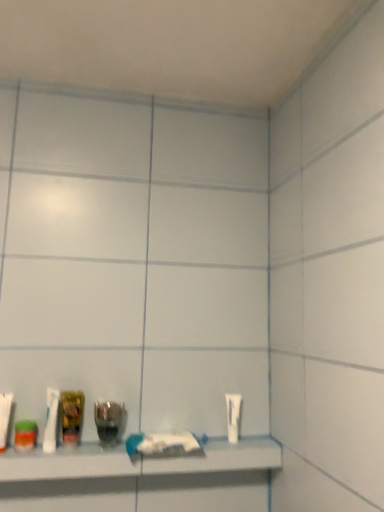
Describe the element at coordinates (25, 435) in the screenshot. I see `translucent plastic mouthwash at lower left, placed as the first mouthwash when sorted from left to right` at that location.

What is the approximate width of translucent plastic mouthwash at lower left, marked as the third mouthwash in a right-to-left arrangement?

It is 3.02 inches.

This screenshot has width=384, height=512. Describe the element at coordinates (108, 420) in the screenshot. I see `clear plastic bottle at lower center, the third mouthwash when ordered from left to right` at that location.

I want to click on translucent plastic mouthwash at lower left, which appears as the 2th mouthwash when viewed from the right, so pos(72,415).

The image size is (384, 512). I want to click on translucent plastic mouthwash at lower left, marked as the third mouthwash in a right-to-left arrangement, so click(25, 435).

Is clear plastic bottle at lower center, which is the 1th mouthwash in right-to-left order, next to white plastic toothbrush at lower left, which is the 1th toiletry from front to back?

No, clear plastic bottle at lower center, which is the 1th mouthwash in right-to-left order, is not next to white plastic toothbrush at lower left, which is the 1th toiletry from front to back.

From a real-world perspective, which object rests below the other?

In real-world perspective, clear plastic bottle at lower center, the third mouthwash when ordered from left to right, is lower.

Is point (120, 409) farther from camera compared to point (0, 436)?

Yes, point (120, 409) is farther from viewer.

Is the position of clear plastic bottle at lower center, the third mouthwash when ordered from left to right, less distant than that of translucent plastic mouthwash at lower left, which appears as the 2th mouthwash when viewed from the right?

No.

From a real-world perspective, is clear plastic bottle at lower center, which is the 1th mouthwash in right-to-left order, physically below translucent plastic mouthwash at lower left, which appears as the 2th mouthwash when viewed from the right?

Correct, in the physical world, clear plastic bottle at lower center, which is the 1th mouthwash in right-to-left order, is lower than translucent plastic mouthwash at lower left, which appears as the 2th mouthwash when viewed from the right.

You are a GUI agent. You are given a task and a screenshot of the screen. Output one action in this format:
    pyautogui.click(x=<x>, y=<y>)
    Task: Click on the mouthwash above the clear plastic bottle at lower center, which is the 1th mouthwash in right-to-left order (from a real-world perspective)
    The width and height of the screenshot is (384, 512).
    Given the screenshot: What is the action you would take?
    pyautogui.click(x=72, y=415)

Is white plastic toothbrush at lower left, which is the 1th toiletry from front to back, positioned beyond the bounds of white matte tube at right, the second toiletry in the left-to-right sequence?

Yes, white plastic toothbrush at lower left, which is the 1th toiletry from front to back, is not within white matte tube at right, the second toiletry in the left-to-right sequence.

Looking at this image, from a real-world perspective, between white plastic toothbrush at lower left, which is the 1th toiletry from front to back, and white matte tube at right, the second toiletry in the left-to-right sequence, who is vertically lower?

In real-world perspective, white plastic toothbrush at lower left, which is the 1th toiletry from front to back, is lower.

Which is farther, (12,401) or (237,426)?

Positioned behind is point (237,426).

Is white plastic toothbrush at lower left, which appears as the first toiletry when viewed from the left, oriented towards white matte tube at right, marked as the 1th toiletry in a right-to-left arrangement?

No, white plastic toothbrush at lower left, which appears as the first toiletry when viewed from the left, is not turned towards white matte tube at right, marked as the 1th toiletry in a right-to-left arrangement.

How different are the orientations of clear plastic bottle at lower center, the third mouthwash when ordered from left to right, and translucent plastic mouthwash at lower left, marked as the third mouthwash in a right-to-left arrangement, in degrees?

0.00207 degrees separate the facing orientations of clear plastic bottle at lower center, the third mouthwash when ordered from left to right, and translucent plastic mouthwash at lower left, marked as the third mouthwash in a right-to-left arrangement.

Between clear plastic bottle at lower center, the third mouthwash when ordered from left to right, and translucent plastic mouthwash at lower left, marked as the third mouthwash in a right-to-left arrangement, which one has smaller width?

Thinner between the two is translucent plastic mouthwash at lower left, marked as the third mouthwash in a right-to-left arrangement.

Is clear plastic bottle at lower center, which is the 1th mouthwash in right-to-left order, in contact with translucent plastic mouthwash at lower left, marked as the third mouthwash in a right-to-left arrangement?

There is a gap between clear plastic bottle at lower center, which is the 1th mouthwash in right-to-left order, and translucent plastic mouthwash at lower left, marked as the third mouthwash in a right-to-left arrangement.

Is clear plastic bottle at lower center, the third mouthwash when ordered from left to right, not inside translucent plastic mouthwash at lower left, marked as the third mouthwash in a right-to-left arrangement?

Indeed, clear plastic bottle at lower center, the third mouthwash when ordered from left to right, is completely outside translucent plastic mouthwash at lower left, marked as the third mouthwash in a right-to-left arrangement.

Based on the photo, does white plastic toothbrush at lower left, acting as the second toiletry starting from the right, have a greater width compared to translucent plastic mouthwash at lower left, marked as the third mouthwash in a right-to-left arrangement?

No.

Is translucent plastic mouthwash at lower left, placed as the first mouthwash when sorted from left to right, at the back of white plastic toothbrush at lower left, which is the second toiletry in back-to-front order?

No.

From the image's perspective, is white plastic toothbrush at lower left, which is the 1th toiletry from front to back, below translucent plastic mouthwash at lower left, placed as the first mouthwash when sorted from left to right?

No.

Who is taller, white matte tube at right, marked as the 1th toiletry in a right-to-left arrangement, or white plastic toothbrush at lower left, acting as the second toiletry starting from the right?

With more height is white matte tube at right, marked as the 1th toiletry in a right-to-left arrangement.

Can you confirm if white matte tube at right, which ranks as the 1th toiletry in back-to-front order, is thinner than white plastic toothbrush at lower left, which appears as the first toiletry when viewed from the left?

Correct, the width of white matte tube at right, which ranks as the 1th toiletry in back-to-front order, is less than that of white plastic toothbrush at lower left, which appears as the first toiletry when viewed from the left.

Is white matte tube at right, the second toiletry in the front-to-back sequence, situated inside white plastic toothbrush at lower left, which is the second toiletry in back-to-front order, or outside?

white matte tube at right, the second toiletry in the front-to-back sequence, is located beyond the bounds of white plastic toothbrush at lower left, which is the second toiletry in back-to-front order.

Can you confirm if white matte tube at right, which ranks as the 1th toiletry in back-to-front order, is bigger than white plastic toothbrush at lower left, which is the second toiletry in back-to-front order?

Yes.

You are a GUI agent. You are given a task and a screenshot of the screen. Output one action in this format:
    pyautogui.click(x=<x>, y=<y>)
    Task: Click on the shelf on the left of white matte tube at right, marked as the 1th toiletry in a right-to-left arrangement
    
    Given the screenshot: What is the action you would take?
    pyautogui.click(x=139, y=461)

In terms of size, does white matte tube at right, which ranks as the 1th toiletry in back-to-front order, appear bigger or smaller than white glossy shelf at lower center?

Clearly, white matte tube at right, which ranks as the 1th toiletry in back-to-front order, is smaller in size than white glossy shelf at lower center.

From a real-world perspective, is white matte tube at right, marked as the 1th toiletry in a right-to-left arrangement, under white glossy shelf at lower center?

No, from a real-world perspective, white matte tube at right, marked as the 1th toiletry in a right-to-left arrangement, is not beneath white glossy shelf at lower center.

From the picture: Is white matte tube at right, the second toiletry in the front-to-back sequence, positioned in front of white glossy shelf at lower center?

No, the depth of white matte tube at right, the second toiletry in the front-to-back sequence, is greater than that of white glossy shelf at lower center.

In order to click on toiletry in front of the clear plastic bottle at lower center, the third mouthwash when ordered from left to right in this screenshot , I will do `click(5, 418)`.

The height and width of the screenshot is (512, 384). I want to click on the 1st mouthwash counting from the left side of the clear plastic bottle at lower center, which is the 1th mouthwash in right-to-left order, so click(72, 415).

Looking at the image, which one is located further to translucent plastic mouthwash at lower left, positioned as the 2th mouthwash in left-to-right order, white matte tube at right, the second toiletry in the left-to-right sequence, or clear plastic bottle at lower center, which is the 1th mouthwash in right-to-left order?

Based on the image, white matte tube at right, the second toiletry in the left-to-right sequence, appears to be further to translucent plastic mouthwash at lower left, positioned as the 2th mouthwash in left-to-right order.

Estimate the real-world distances between objects in this image. Which object is closer to clear plastic bottle at lower center, the third mouthwash when ordered from left to right, white matte tube at right, which ranks as the 1th toiletry in back-to-front order, or white plastic toothbrush at lower left, which is the 1th toiletry from front to back?

white plastic toothbrush at lower left, which is the 1th toiletry from front to back, is positioned closer to the anchor clear plastic bottle at lower center, the third mouthwash when ordered from left to right.

From the image, which object appears to be nearer to white glossy shelf at lower center, clear plastic bottle at lower center, which is the 1th mouthwash in right-to-left order, or white matte tube at right, the second toiletry in the left-to-right sequence?

Based on the image, clear plastic bottle at lower center, which is the 1th mouthwash in right-to-left order, appears to be nearer to white glossy shelf at lower center.

Which object lies further to the anchor point white matte tube at right, the second toiletry in the left-to-right sequence, translucent plastic mouthwash at lower left, marked as the third mouthwash in a right-to-left arrangement, or clear plastic bottle at lower center, which is the 1th mouthwash in right-to-left order?

translucent plastic mouthwash at lower left, marked as the third mouthwash in a right-to-left arrangement.

When comparing their distances from white matte tube at right, marked as the 1th toiletry in a right-to-left arrangement, does translucent plastic mouthwash at lower left, positioned as the 2th mouthwash in left-to-right order, or translucent plastic mouthwash at lower left, marked as the third mouthwash in a right-to-left arrangement, seem further?

Among the two, translucent plastic mouthwash at lower left, marked as the third mouthwash in a right-to-left arrangement, is located further to white matte tube at right, marked as the 1th toiletry in a right-to-left arrangement.

Estimate the real-world distances between objects in this image. Which object is closer to white glossy shelf at lower center, white plastic toothbrush at lower left, acting as the second toiletry starting from the right, or translucent plastic mouthwash at lower left, positioned as the 2th mouthwash in left-to-right order?

translucent plastic mouthwash at lower left, positioned as the 2th mouthwash in left-to-right order.

When comparing their distances from translucent plastic mouthwash at lower left, which appears as the 2th mouthwash when viewed from the right, does white glossy shelf at lower center or clear plastic bottle at lower center, which is the 1th mouthwash in right-to-left order, seem closer?

clear plastic bottle at lower center, which is the 1th mouthwash in right-to-left order.

Which object lies further to the anchor point translucent plastic mouthwash at lower left, placed as the first mouthwash when sorted from left to right, white matte tube at right, the second toiletry in the left-to-right sequence, or white plastic toothbrush at lower left, which is the second toiletry in back-to-front order?

The object further to translucent plastic mouthwash at lower left, placed as the first mouthwash when sorted from left to right, is white matte tube at right, the second toiletry in the left-to-right sequence.

Locate an element on the screen. This screenshot has width=384, height=512. shelf between clear plastic bottle at lower center, which is the 1th mouthwash in right-to-left order, and white matte tube at right, which ranks as the 1th toiletry in back-to-front order is located at coordinates (139, 461).

The height and width of the screenshot is (512, 384). I want to click on mouthwash between translucent plastic mouthwash at lower left, which appears as the 2th mouthwash when viewed from the right, and white glossy shelf at lower center, so click(x=108, y=420).

Locate an element on the screen. mouthwash between white plastic toothbrush at lower left, which appears as the first toiletry when viewed from the left, and translucent plastic mouthwash at lower left, which appears as the 2th mouthwash when viewed from the right is located at coordinates (25, 435).

This screenshot has width=384, height=512. Identify the location of mouthwash between translucent plastic mouthwash at lower left, placed as the first mouthwash when sorted from left to right, and clear plastic bottle at lower center, the third mouthwash when ordered from left to right, from left to right. (72, 415).